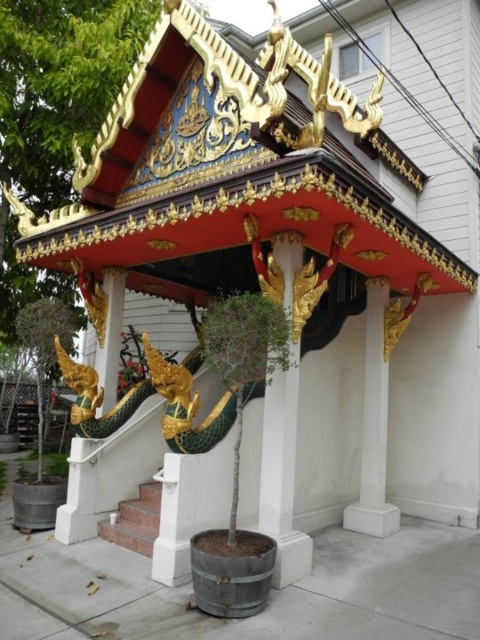
Question: Can you confirm if white marble pillar at center is positioned to the right of gold metallic dragon at center?

Choices:
 (A) yes
 (B) no

Answer: (A)

Question: Can you confirm if marble stairs at lower center is bigger than gold metallic dragon at center?

Choices:
 (A) no
 (B) yes

Answer: (A)

Question: Which object appears farthest from the camera in this image?

Choices:
 (A) white glossy pillar at center
 (B) gold metallic dragon at center
 (C) marble stairs at lower center
 (D) white marble pillar at center

Answer: (B)

Question: Which object is closer to the camera taking this photo?

Choices:
 (A) marble stairs at lower center
 (B) gold metallic dragon at center
 (C) white marble pillar at center

Answer: (A)

Question: Which point appears closest to the camera in this image?

Choices:
 (A) click(361, 516)
 (B) click(260, 486)
 (C) click(149, 532)
 (D) click(104, 385)

Answer: (B)

Question: Does white glossy pillar at center appear over gold metallic dragon at center?

Choices:
 (A) no
 (B) yes

Answer: (A)